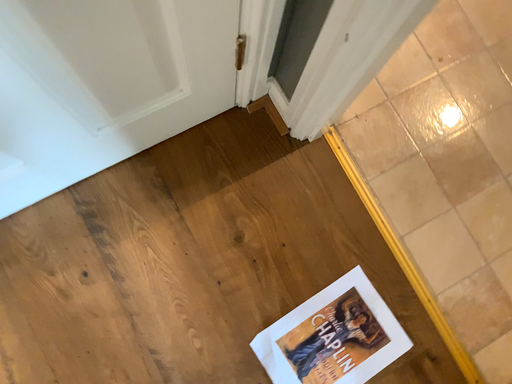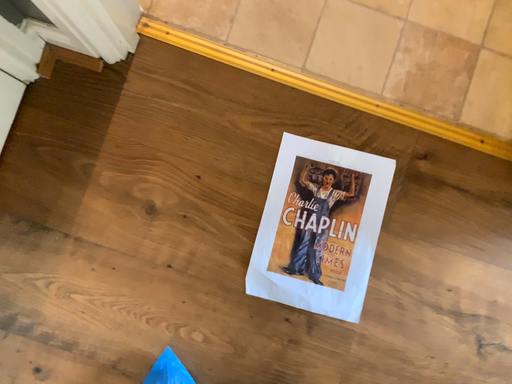
Question: Which way did the camera rotate in the video?

Choices:
 (A) rotated upward
 (B) rotated downward

Answer: (B)